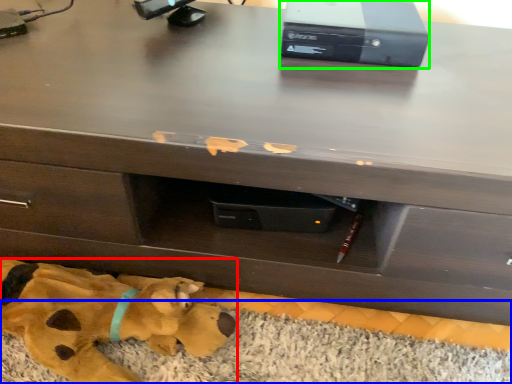
Question: Which object is the farthest from toy (highlighted by a red box)? Choose among these: mat (highlighted by a blue box) or computer (highlighted by a green box).

Choices:
 (A) mat
 (B) computer

Answer: (B)